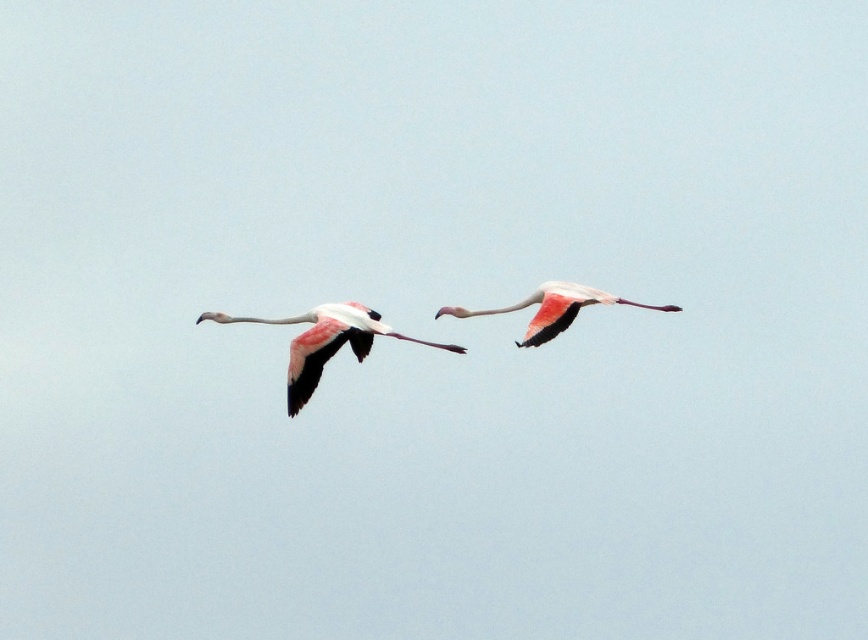
At what (x,y) coordinates should I click in order to perform the action: click on pink feathered flamingo at center. Please return your answer as a coordinate pair (x, y). Looking at the image, I should click on (324, 342).

Between point (372, 324) and point (551, 339), which one is positioned in front?

Point (551, 339) is in front.

In order to click on pink feathered flamingo at center in this screenshot , I will do [x=324, y=342].